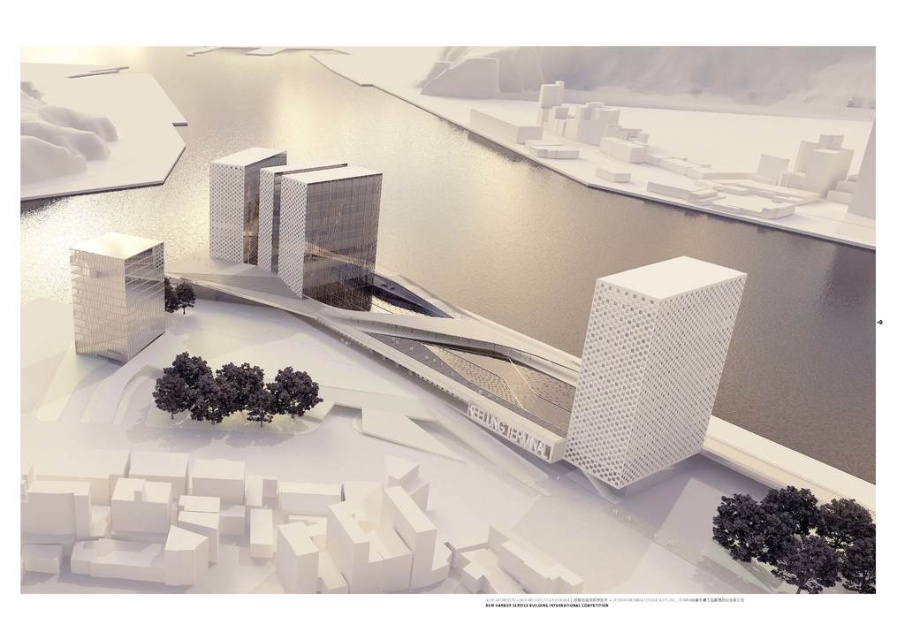
Question: Is metallic glass tower at center to the right of white textured cube at lower left from the viewer's perspective?

Choices:
 (A) no
 (B) yes

Answer: (B)

Question: Where is white textured cube at lower left located in relation to polished glass tower at center in the image?

Choices:
 (A) right
 (B) left

Answer: (B)

Question: Based on their relative distances, which object is nearer to the white perforated cube at center-right?

Choices:
 (A) metallic glass tower at center
 (B) white textured cube at lower left

Answer: (B)

Question: Which point appears farthest from the camera in this image?

Choices:
 (A) (145, 275)
 (B) (698, 332)

Answer: (A)

Question: Estimate the real-world distances between objects in this image. Which object is farther from the metallic glass tower at center?

Choices:
 (A) white perforated cube at center-right
 (B) white textured cube at lower left
 (C) polished glass tower at center

Answer: (A)

Question: Considering the relative positions of metallic glass tower at center and polished glass tower at center in the image provided, where is metallic glass tower at center located with respect to polished glass tower at center?

Choices:
 (A) below
 (B) above

Answer: (A)